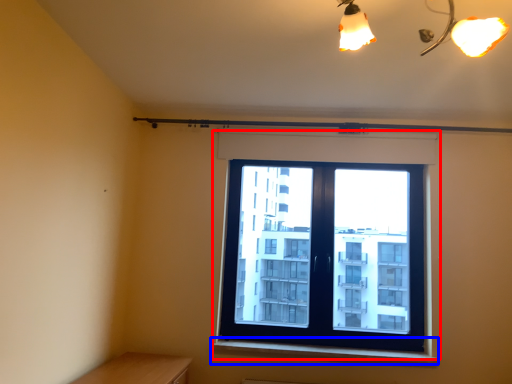
Question: Which object is closer to the camera taking this photo, window (highlighted by a red box) or window sill (highlighted by a blue box)?

Choices:
 (A) window
 (B) window sill

Answer: (B)